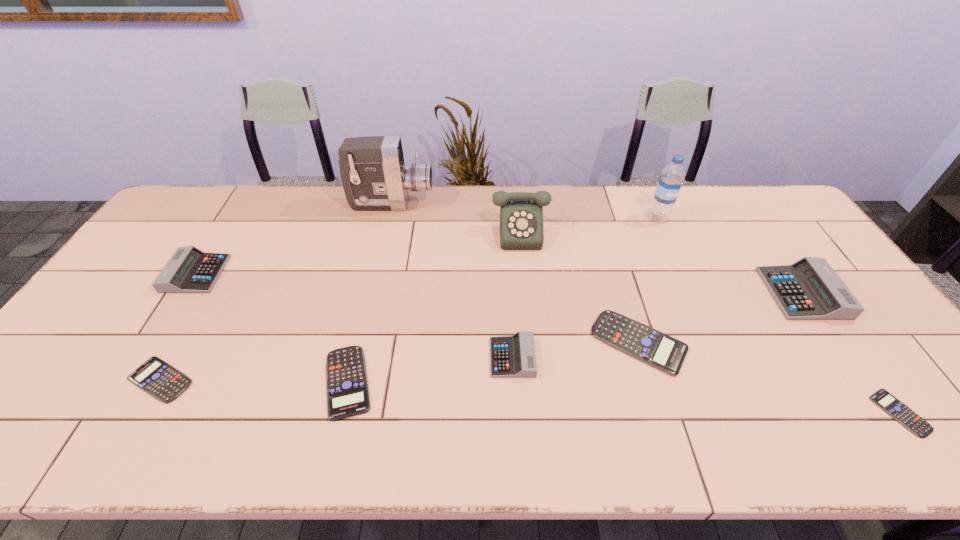
Identify the location of free region located on the dial of the eighth shortest object. (551, 360).

Where is `free space located 0.100m on the left of the biggest gray calculator`? free space located 0.100m on the left of the biggest gray calculator is located at coordinates (735, 293).

You are a GUI agent. You are given a task and a screenshot of the screen. Output one action in this format:
    pyautogui.click(x=<x>, y=<y>)
    Task: Click on the vacant region located 0.100m on the left of the leftmost gray calculator
    The width and height of the screenshot is (960, 540).
    Given the screenshot: What is the action you would take?
    pyautogui.click(x=137, y=274)

Image resolution: width=960 pixels, height=540 pixels. What are the coordinates of `free space located 0.270m on the left of the smallest gray calculator` in the screenshot? It's located at (383, 357).

Identify the location of vacant space situated 0.370m on the back of the fourth tallest calculator. (604, 225).

What are the coordinates of `vacant space located on the right of the third shortest object` in the screenshot? It's located at (421, 382).

In order to click on free space located 0.190m on the right of the sixth tallest calculator in this screenshot , I will do `click(273, 380)`.

You are a GUI agent. You are given a task and a screenshot of the screen. Output one action in this format:
    pyautogui.click(x=<x>, y=<y>)
    Task: Click on the vacant space situated on the left of the shortest object
    This screenshot has width=960, height=540.
    Given the screenshot: What is the action you would take?
    pyautogui.click(x=786, y=413)

This screenshot has width=960, height=540. What are the coordinates of `camcorder that is at the far edge` in the screenshot? It's located at (374, 176).

At what (x,y) coordinates should I click in order to perform the action: click on water bottle at the far edge. Please return your answer as a coordinate pair (x, y). This screenshot has height=540, width=960. Looking at the image, I should click on (671, 179).